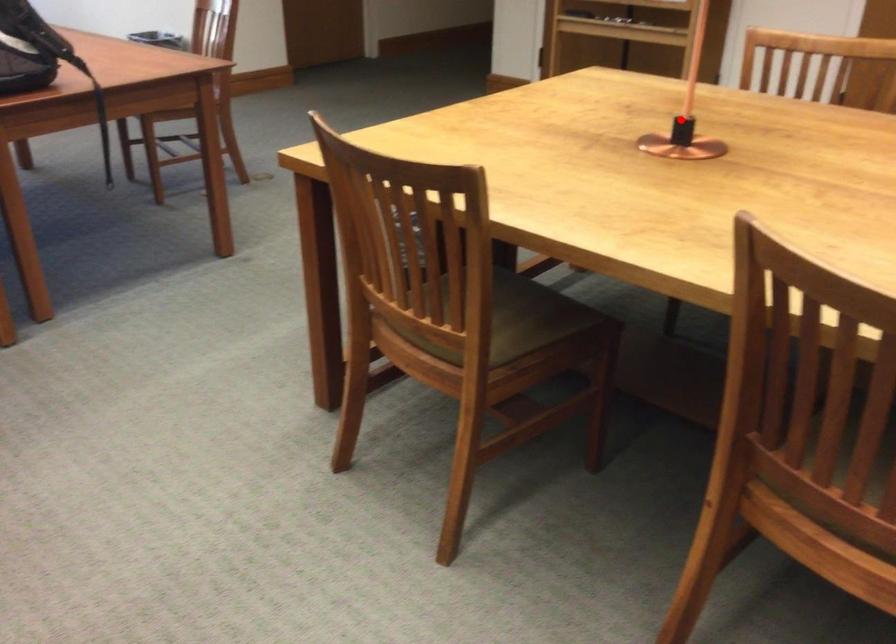
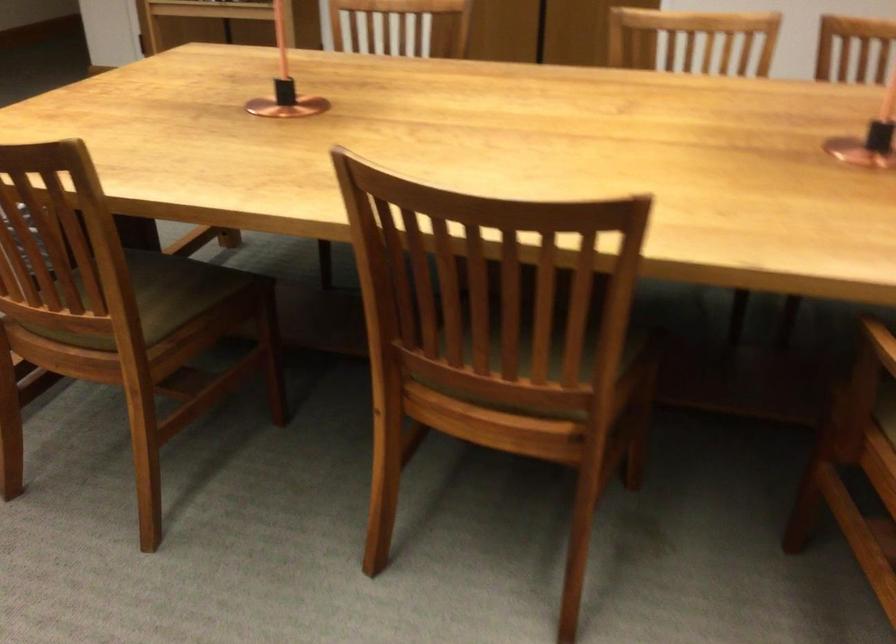
Find the pixel in the second image that matches the highlighted location in the first image.

(285, 84)